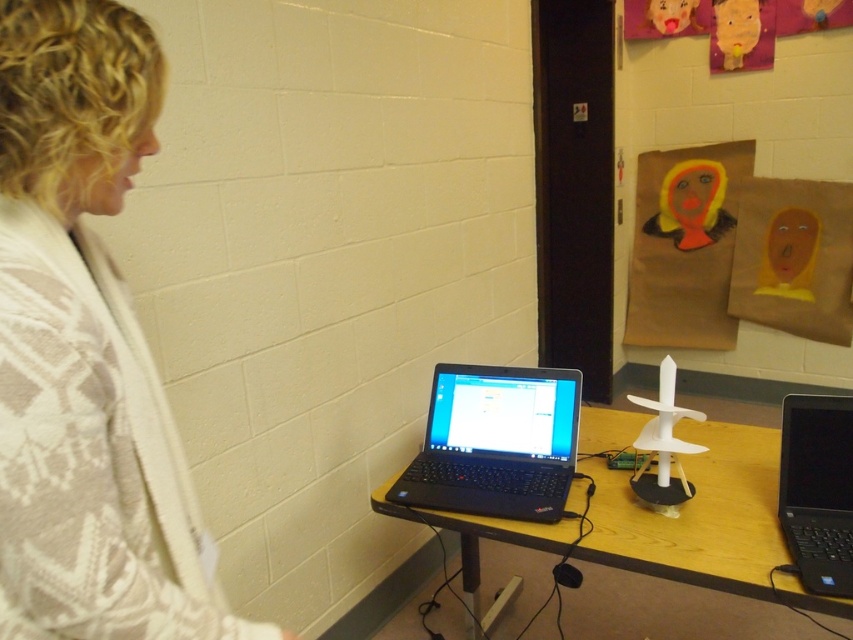
Who is higher up, white textured sweater at left or black matte laptop at center?

white textured sweater at left

Is white textured sweater at left positioned before black matte laptop at center?

Yes, it is in front of black matte laptop at center.

Does point (154, 125) come closer to viewer compared to point (498, 413)?

Yes, it is in front of point (498, 413).

At what (x,y) coordinates should I click in order to perform the action: click on white textured sweater at left. Please return your answer as a coordinate pair (x, y). Image resolution: width=853 pixels, height=640 pixels. Looking at the image, I should click on (86, 349).

Between black matte laptop at center and black plastic laptop at right, which one appears on the right side from the viewer's perspective?

Positioned to the right is black plastic laptop at right.

Consider the image. Who is shorter, black matte laptop at center or black plastic laptop at right?

black matte laptop at center is shorter.

Does point (509, 401) come closer to viewer compared to point (793, 440)?

No, it is not.

The height and width of the screenshot is (640, 853). Find the location of `black matte laptop at center`. black matte laptop at center is located at coordinates (495, 442).

Does white textured sweater at left have a lesser height compared to black plastic laptop at right?

In fact, white textured sweater at left may be taller than black plastic laptop at right.

Identify the location of white textured sweater at left. This screenshot has width=853, height=640. (86, 349).

Who is more forward, (56,588) or (788,444)?

Point (56,588)

Where is `white textured sweater at left`? Image resolution: width=853 pixels, height=640 pixels. white textured sweater at left is located at coordinates (86, 349).